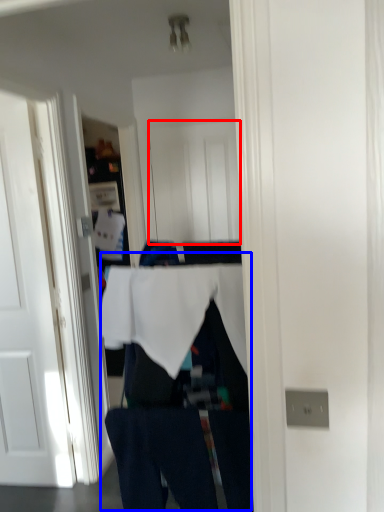
Question: Which object is closer to the camera taking this photo, door (highlighted by a red box) or person (highlighted by a blue box)?

Choices:
 (A) door
 (B) person

Answer: (B)